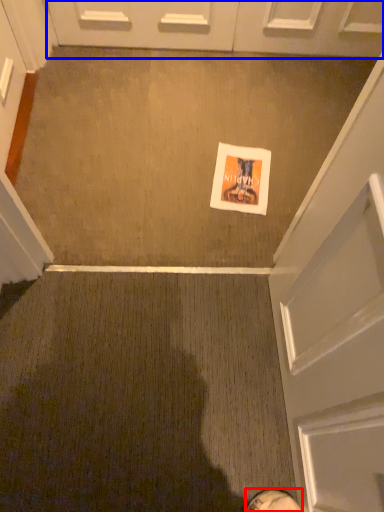
Question: Which of the following is the farthest to the observer, footwear (highlighted by a red box) or door (highlighted by a blue box)?

Choices:
 (A) footwear
 (B) door

Answer: (B)